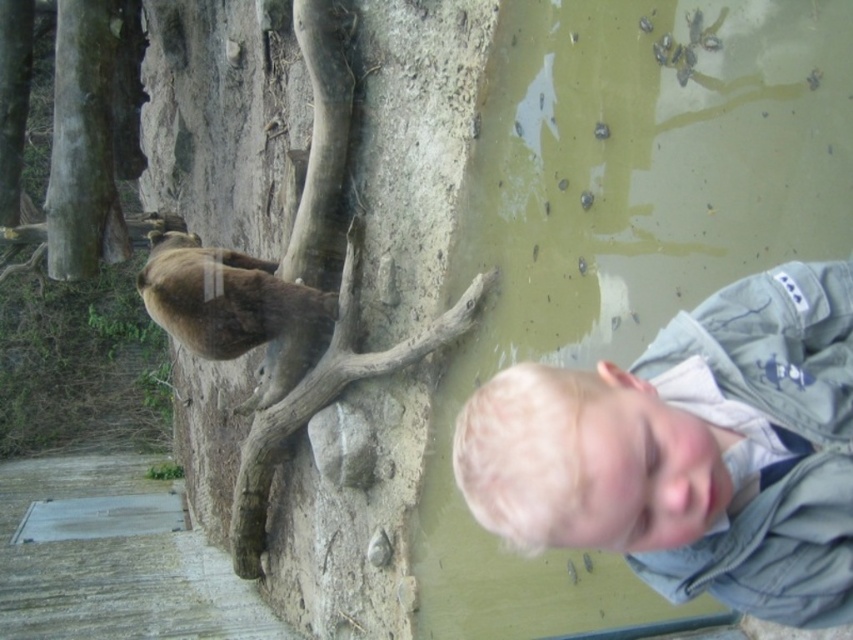
Between brown rough bark tree at upper left and blonde hair at lower right, which one has less height?

blonde hair at lower right is shorter.

Is brown rough bark tree at upper left closer to camera compared to blonde hair at lower right?

No, brown rough bark tree at upper left is further to the viewer.

The height and width of the screenshot is (640, 853). I want to click on brown rough bark tree at upper left, so click(410, 147).

Between blonde hair at lower right and brown furry bear at upper left, which one is positioned higher?

brown furry bear at upper left is above.

Does point (689, 346) come behind point (173, 298)?

No, (689, 346) is in front of (173, 298).

At what (x,y) coordinates should I click in order to perform the action: click on blonde hair at lower right. Please return your answer as a coordinate pair (x, y). The image size is (853, 640). Looking at the image, I should click on (689, 451).

Is brown rough bark tree at upper left smaller than brown furry bear at upper left?

Actually, brown rough bark tree at upper left might be larger than brown furry bear at upper left.

Looking at this image, who is more forward, [248,243] or [198,340]?

Point [198,340] is in front.

Identify the location of brown rough bark tree at upper left. The height and width of the screenshot is (640, 853). (410, 147).